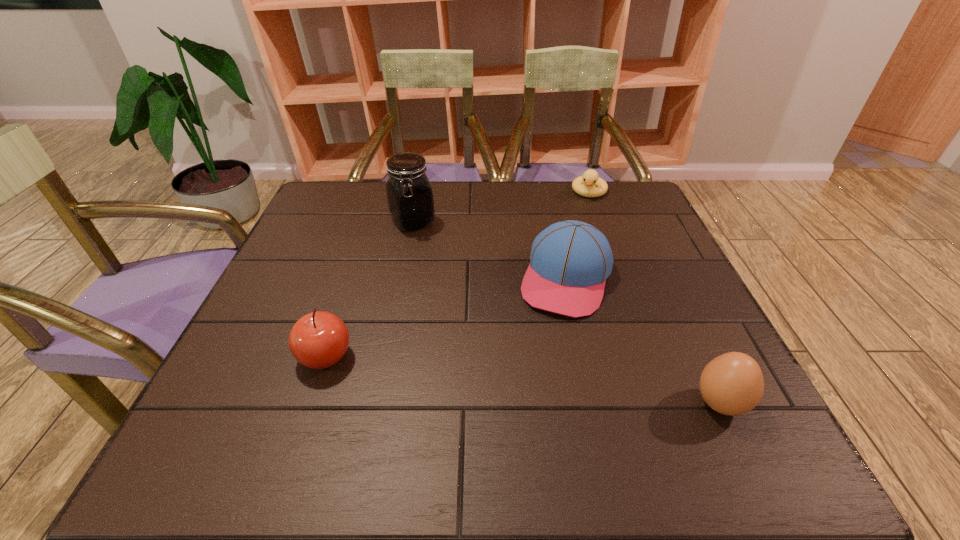
Where is `the second nearest object`? the second nearest object is located at coordinates pos(318,340).

You are a GUI agent. You are given a task and a screenshot of the screen. Output one action in this format:
    pyautogui.click(x=<x>, y=<y>)
    Task: Click on the nearest object
    The image size is (960, 540).
    Given the screenshot: What is the action you would take?
    pyautogui.click(x=732, y=384)

You are a GUI agent. You are given a task and a screenshot of the screen. Output one action in this format:
    pyautogui.click(x=<x>, y=<y>)
    Task: Click on the baseball cap
    The width and height of the screenshot is (960, 540).
    Given the screenshot: What is the action you would take?
    pyautogui.click(x=570, y=260)

Find the location of a particular element. The width and height of the screenshot is (960, 540). the shortest object is located at coordinates (584, 185).

Identify the location of the farthest object. (584, 185).

Image resolution: width=960 pixels, height=540 pixels. Find the location of `jar`. jar is located at coordinates (410, 199).

The image size is (960, 540). Find the location of `the fourth nearest object`. the fourth nearest object is located at coordinates tap(410, 199).

Find the location of a particular element. The height and width of the screenshot is (540, 960). free space located 0.320m on the back of the apple is located at coordinates (364, 241).

You are a GUI agent. You are given a task and a screenshot of the screen. Output one action in this format:
    pyautogui.click(x=<x>, y=<y>)
    Task: Click on the vacant space located on the back of the nearest object
    
    Given the screenshot: What is the action you would take?
    pyautogui.click(x=667, y=292)

This screenshot has height=540, width=960. In order to click on vacant space located 0.200m on the front-facing side of the third farthest object in this screenshot , I will do tap(532, 394).